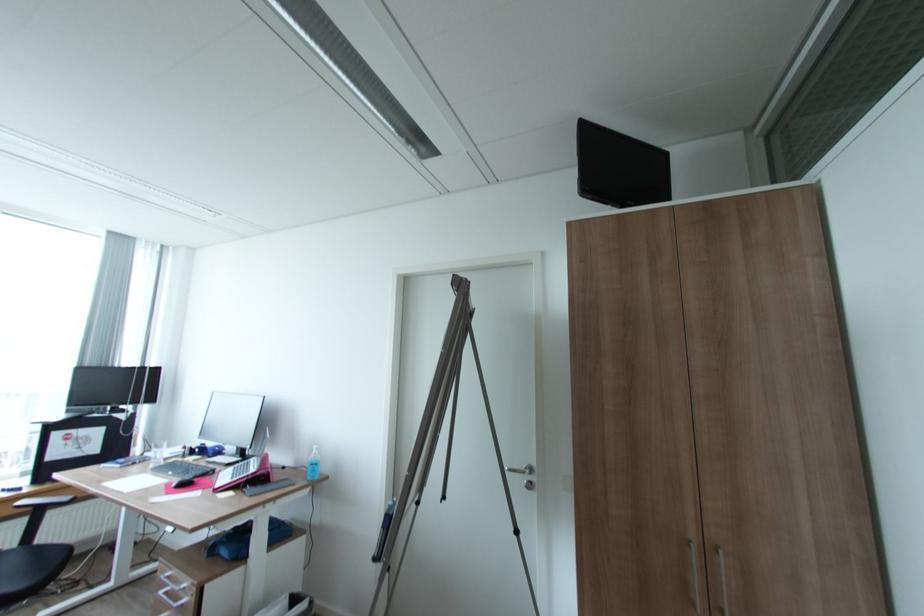
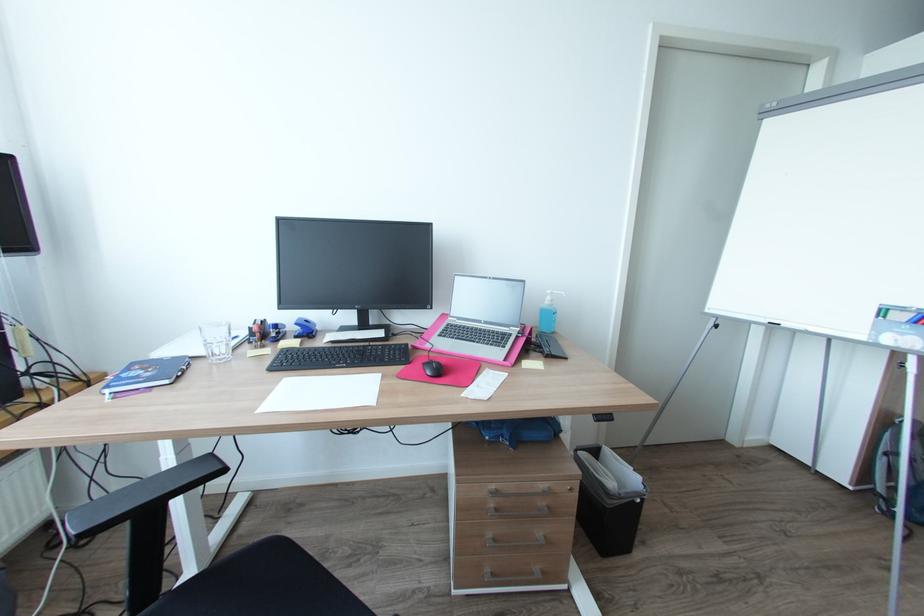
The point at [175,573] is marked in the first image. Where is the corresponding point in the second image?

(497, 487)